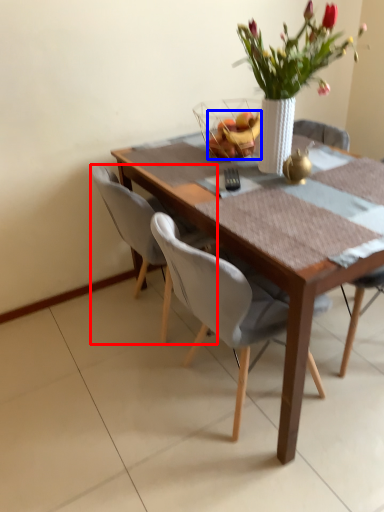
Question: Among these objects, which one is nearest to the camera, chair (highlighted by a red box) or fruit (highlighted by a blue box)?

Choices:
 (A) chair
 (B) fruit

Answer: (A)